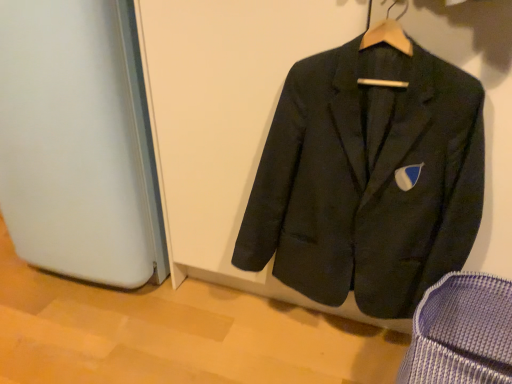
Identify the location of vacant space underneath matte black suit at center (from a real-world perspective). (327, 344).